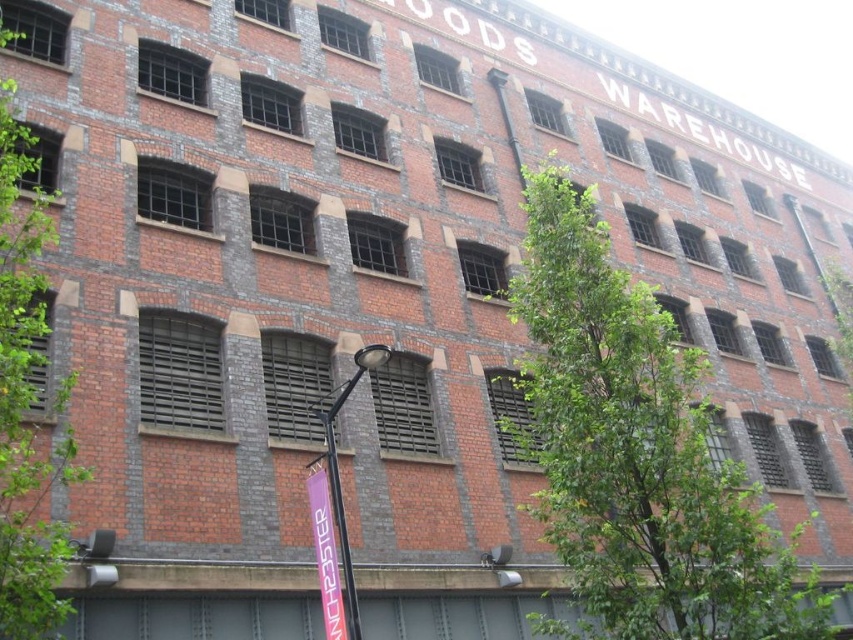
You are standing at the lamppost and looking towards the warehouse building. There are two points marked on the ground in front of you. The first point is at coordinate point (x=57, y=387) and the second point is at coordinate point (x=343, y=566). Which point is closer to the warehouse building?

Point (x=57, y=387) is behind point (x=343, y=566), so the point closer to the warehouse building is point (x=57, y=387).

You are standing at the entrance of the warehouse and see a point marked at coordinates (338, 472). What object is located at that point?

The point at coordinates (338, 472) indicates the location of the black metal lamp post at center.

You are a delivery driver who needs to park your truck near the black metal lamp post at center. There is a green leafy tree at left nearby. Which object takes up more space in the image, requiring you to be cautious while parking?

The green leafy tree at left is bigger than the black metal lamp post at center, so you should be cautious of its larger size while parking near the black metal lamp post at center.